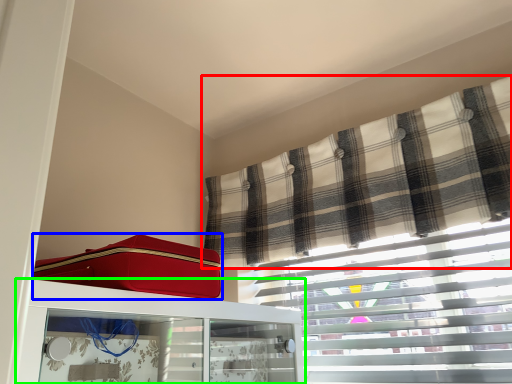
Question: Based on their relative distances, which object is nearer to curtain (highlighted by a red box)? Choose from suitcase (highlighted by a blue box) and furniture (highlighted by a green box).

Choices:
 (A) suitcase
 (B) furniture

Answer: (B)